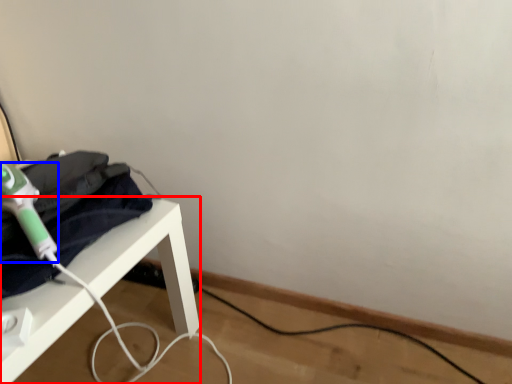
Question: Which of the following is the closest to the observer, furniture (highlighted by a red box) or hair drier (highlighted by a blue box)?

Choices:
 (A) furniture
 (B) hair drier

Answer: (A)